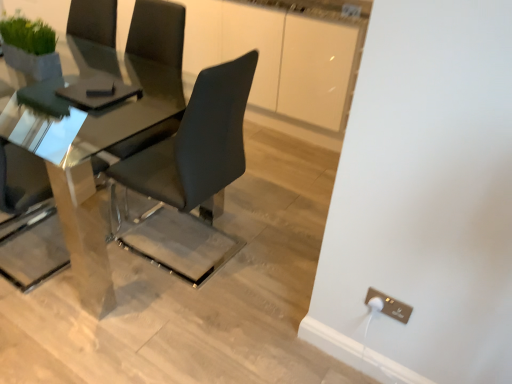
Question: Should I look upward or downward to see polished glass table at center?

Choices:
 (A) down
 (B) up

Answer: (B)

Question: From the image's perspective, is matte black chair at center below polished glass table at center?

Choices:
 (A) no
 (B) yes

Answer: (B)

Question: Is matte black chair at center oriented away from polished glass table at center?

Choices:
 (A) yes
 (B) no

Answer: (A)

Question: Is matte black chair at center placed right next to polished glass table at center?

Choices:
 (A) no
 (B) yes

Answer: (A)

Question: Does matte black chair at center have a greater width compared to polished glass table at center?

Choices:
 (A) no
 (B) yes

Answer: (A)

Question: Is matte black chair at center bigger than polished glass table at center?

Choices:
 (A) no
 (B) yes

Answer: (A)

Question: Does matte black chair at center contain polished glass table at center?

Choices:
 (A) yes
 (B) no

Answer: (B)

Question: Does polished glass table at center have a greater height compared to matte black chair at center?

Choices:
 (A) yes
 (B) no

Answer: (B)

Question: Does polished glass table at center have a greater width compared to matte black chair at center?

Choices:
 (A) no
 (B) yes

Answer: (B)

Question: Can you confirm if polished glass table at center is positioned to the right of matte black chair at center?

Choices:
 (A) no
 (B) yes

Answer: (A)

Question: Considering the relative sizes of polished glass table at center and matte black chair at center in the image provided, is polished glass table at center smaller than matte black chair at center?

Choices:
 (A) yes
 (B) no

Answer: (B)

Question: Is the depth of polished glass table at center less than that of matte black chair at center?

Choices:
 (A) no
 (B) yes

Answer: (A)

Question: Could you tell me if polished glass table at center is facing matte black chair at center?

Choices:
 (A) yes
 (B) no

Answer: (B)

Question: Can you confirm if matte black chair at center is wider than metallic gold electrical outlet at lower right?

Choices:
 (A) no
 (B) yes

Answer: (B)